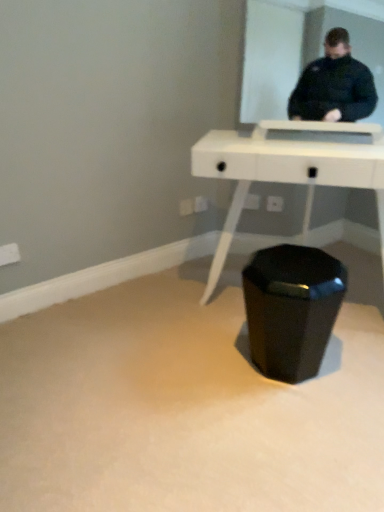
Identify the location of free space to the left of black glossy waste container at center. (213, 366).